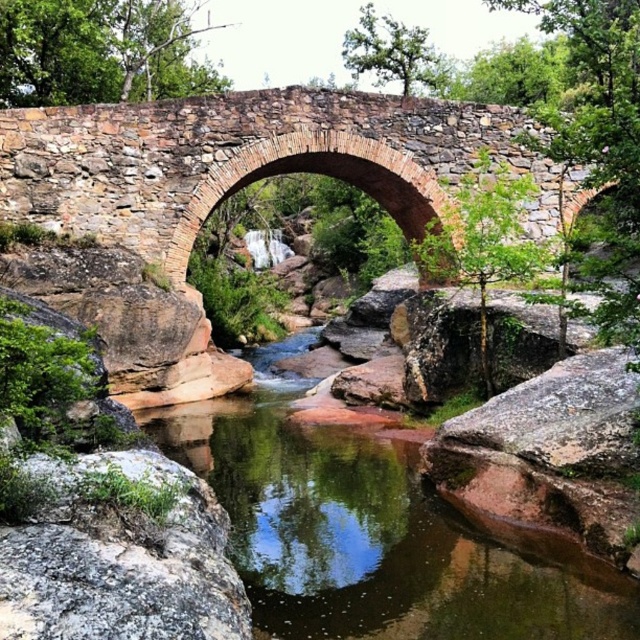
Locate an element on the screen. The width and height of the screenshot is (640, 640). smooth rock river at center is located at coordinates (372, 532).

Measure the distance between smooth rock river at center and gray/granite boulder at lower left.

30.50 feet

Which is in front, point (342, 552) or point (154, 602)?

Positioned in front is point (154, 602).

You are a GUI agent. You are given a task and a screenshot of the screen. Output one action in this format:
    pyautogui.click(x=<x>, y=<y>)
    Task: Click on the smooth rock river at center
    
    Given the screenshot: What is the action you would take?
    pyautogui.click(x=372, y=532)

From the picture: Between smooth rock river at center and rustic stone bridge at center, which one is positioned higher?

rustic stone bridge at center

Can you confirm if smooth rock river at center is positioned to the left of rustic stone bridge at center?

Indeed, smooth rock river at center is positioned on the left side of rustic stone bridge at center.

What are the coordinates of `smooth rock river at center` in the screenshot? It's located at (372, 532).

Can you confirm if rustic stone bridge at center is positioned to the left of gray/granite boulder at lower left?

Incorrect, rustic stone bridge at center is not on the left side of gray/granite boulder at lower left.

Who is shorter, rustic stone bridge at center or gray/granite boulder at lower left?

Standing shorter between the two is gray/granite boulder at lower left.

Locate an element on the screen. The image size is (640, 640). rustic stone bridge at center is located at coordinates (244, 160).

You are a GUI agent. You are given a task and a screenshot of the screen. Output one action in this format:
    pyautogui.click(x=<x>, y=<y>)
    Task: Click on the rustic stone bridge at center
    The image size is (640, 640).
    Given the screenshot: What is the action you would take?
    pyautogui.click(x=244, y=160)